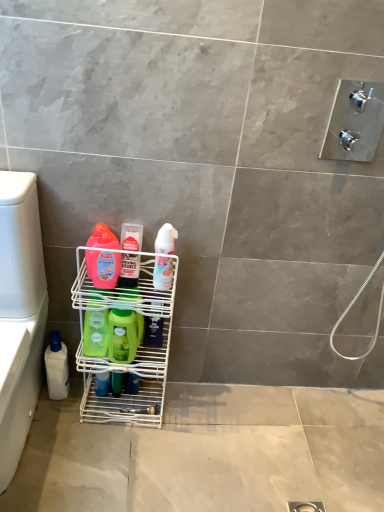
Describe the element at coordinates (122, 336) in the screenshot. I see `green matte bottle at center, the fourth cleaning product from the left` at that location.

In order to face translucent plastic bottle at center, which appears as the 5th cleaning product when viewed from the left, should I rotate leftwards or rightwards?

Turn left by 8.114 degrees to look at translucent plastic bottle at center, which appears as the 5th cleaning product when viewed from the left.

What do you see at coordinates (95, 333) in the screenshot? I see `green matte bottle at center, which ranks as the 2th cleaning product in left-to-right order` at bounding box center [95, 333].

What is the approximate height of green matte bottle at center, which is counted as the 6th cleaning product, starting from the left?

The height of green matte bottle at center, which is counted as the 6th cleaning product, starting from the left, is 6.02 inches.

Find the location of `green matte bottle at center, positioned as the 2th cleaning product in right-to-left order`. green matte bottle at center, positioned as the 2th cleaning product in right-to-left order is located at coordinates (153, 331).

Image resolution: width=384 pixels, height=512 pixels. In order to click on green matte bottle at center, the fourth cleaning product from the left in this screenshot , I will do `click(122, 336)`.

Which of these two, green matte bottle at center, arranged as the sixth cleaning product when viewed from the right, or white plastic bottle at lower left, is bigger?

With larger size is white plastic bottle at lower left.

Between green matte bottle at center, arranged as the sixth cleaning product when viewed from the right, and white plastic bottle at lower left, which one is positioned behind?

green matte bottle at center, arranged as the sixth cleaning product when viewed from the right, is further from the camera.

From a real-world perspective, count 2nd cleaning products downward from the white plastic bottle at lower left and point to it. Please provide its 2D coordinates.

[(95, 333)]

From their relative heights in the image, would you say green matte bottle at center, arranged as the sixth cleaning product when viewed from the right, is taller or shorter than white plastic bottle at lower left?

In the image, green matte bottle at center, arranged as the sixth cleaning product when viewed from the right, appears to be shorter than white plastic bottle at lower left.

Can you tell me how much matte pink bottle at center left, acting as the fifth cleaning product starting from the right, and green matte bottle at center, arranged as the sixth cleaning product when viewed from the right, differ in facing direction?

There is a 3.24-degree angle between the facing directions of matte pink bottle at center left, acting as the fifth cleaning product starting from the right, and green matte bottle at center, arranged as the sixth cleaning product when viewed from the right.

Considering the relative positions of matte pink bottle at center left, acting as the fifth cleaning product starting from the right, and green matte bottle at center, which ranks as the 2th cleaning product in left-to-right order, in the image provided, is matte pink bottle at center left, acting as the fifth cleaning product starting from the right, to the left or to the right of green matte bottle at center, which ranks as the 2th cleaning product in left-to-right order,?

From the image, it's evident that matte pink bottle at center left, acting as the fifth cleaning product starting from the right, is to the right of green matte bottle at center, which ranks as the 2th cleaning product in left-to-right order.

Which object is wider, matte pink bottle at center left, acting as the fifth cleaning product starting from the right, or green matte bottle at center, arranged as the sixth cleaning product when viewed from the right?

Wider between the two is green matte bottle at center, arranged as the sixth cleaning product when viewed from the right.

In the scene shown: Is green matte bottle at center, which ranks as the 2th cleaning product in left-to-right order, at the back of matte pink bottle at center left, which is the third cleaning product from left to right?

matte pink bottle at center left, which is the third cleaning product from left to right, is not turned away from green matte bottle at center, which ranks as the 2th cleaning product in left-to-right order.

Does white plastic bottle at lower left touch white glossy lotion at center, the first cleaning product positioned from the right?

white plastic bottle at lower left and white glossy lotion at center, the first cleaning product positioned from the right, are not in contact.

From the image's perspective, count 5th cleaning products upward from the white plastic bottle at lower left and point to it. Please provide its 2D coordinates.

[(163, 273)]

Based on the photo, is white glossy lotion at center, the first cleaning product positioned from the right, at the back of white plastic bottle at lower left?

No, white plastic bottle at lower left is not facing the opposite direction of white glossy lotion at center, the first cleaning product positioned from the right.

From the image's perspective, is white plastic bottle at lower left positioned above or below white glossy lotion at center, the first cleaning product positioned from the right?

Clearly, from the image's perspective, white plastic bottle at lower left is below white glossy lotion at center, the first cleaning product positioned from the right.

Could you tell me if green matte bottle at center, which ranks as the 2th cleaning product in left-to-right order, is facing translucent plastic bottle at center, which appears as the 5th cleaning product when viewed from the left?

No.

Can you confirm if green matte bottle at center, which ranks as the 2th cleaning product in left-to-right order, is thinner than translucent plastic bottle at center, arranged as the third cleaning product when viewed from the right?

No, green matte bottle at center, which ranks as the 2th cleaning product in left-to-right order, is not thinner than translucent plastic bottle at center, arranged as the third cleaning product when viewed from the right.

Would you say green matte bottle at center, which ranks as the 2th cleaning product in left-to-right order, is inside or outside translucent plastic bottle at center, which appears as the 5th cleaning product when viewed from the left?

green matte bottle at center, which ranks as the 2th cleaning product in left-to-right order, lies outside translucent plastic bottle at center, which appears as the 5th cleaning product when viewed from the left.

From the image's perspective, is green matte bottle at center, arranged as the sixth cleaning product when viewed from the right, located above or below translucent plastic bottle at center, arranged as the third cleaning product when viewed from the right?

Clearly, from the image's perspective, green matte bottle at center, arranged as the sixth cleaning product when viewed from the right, is below translucent plastic bottle at center, arranged as the third cleaning product when viewed from the right.

Does green matte bottle at center, which is counted as the 6th cleaning product, starting from the left, lie in front of white glossy lotion at center, the first cleaning product positioned from the right?

No, green matte bottle at center, which is counted as the 6th cleaning product, starting from the left, is behind white glossy lotion at center, the first cleaning product positioned from the right.

Between green matte bottle at center, which is counted as the 6th cleaning product, starting from the left, and white glossy lotion at center, the first cleaning product positioned from the right, which one has smaller width?

white glossy lotion at center, the first cleaning product positioned from the right.

Does green matte bottle at center, which is counted as the 6th cleaning product, starting from the left, have a smaller size compared to white glossy lotion at center, the first cleaning product positioned from the right?

Correct, green matte bottle at center, which is counted as the 6th cleaning product, starting from the left, occupies less space than white glossy lotion at center, the first cleaning product positioned from the right.

From a real-world perspective, which is physically below, green matte bottle at center, which is counted as the 6th cleaning product, starting from the left, or white glossy lotion at center, the 7th cleaning product positioned from the left?

green matte bottle at center, which is counted as the 6th cleaning product, starting from the left, is physically lower.

Considering the positions of objects green matte bottle at center, which is counted as the 6th cleaning product, starting from the left, and white plastic bottle at lower left in the image provided, who is behind, green matte bottle at center, which is counted as the 6th cleaning product, starting from the left, or white plastic bottle at lower left?

green matte bottle at center, which is counted as the 6th cleaning product, starting from the left, is further from the camera.

Could you measure the distance between green matte bottle at center, which is counted as the 6th cleaning product, starting from the left, and white plastic bottle at lower left?

green matte bottle at center, which is counted as the 6th cleaning product, starting from the left, is 15.74 inches away from white plastic bottle at lower left.

Which is farther from the camera, (159, 331) or (13, 357)?

The point (159, 331) is behind.

Is green matte bottle at center, positioned as the 2th cleaning product in right-to-left order, to the right of white plastic bottle at lower left from the viewer's perspective?

Correct, you'll find green matte bottle at center, positioned as the 2th cleaning product in right-to-left order, to the right of white plastic bottle at lower left.

Is matte pink bottle at center left, which is the third cleaning product from left to right, in contact with white plastic bottle at lower left?

No, matte pink bottle at center left, which is the third cleaning product from left to right, is not beside white plastic bottle at lower left.

Does matte pink bottle at center left, which is the third cleaning product from left to right, appear on the right side of white plastic bottle at lower left?

Yes, matte pink bottle at center left, which is the third cleaning product from left to right, is to the right of white plastic bottle at lower left.

Measure the distance from matte pink bottle at center left, acting as the fifth cleaning product starting from the right, to white plastic bottle at lower left.

The distance of matte pink bottle at center left, acting as the fifth cleaning product starting from the right, from white plastic bottle at lower left is 10.18 inches.

Considering the points (97, 254) and (22, 298), which point is behind, point (97, 254) or point (22, 298)?

The point (97, 254) is farther.

Locate an element on the screen. This screenshot has width=384, height=512. the 2nd cleaning product located beneath the white plastic bottle at lower left (from a real-world perspective) is located at coordinates click(95, 333).

Starting from the matte pink bottle at center left, which is the third cleaning product from left to right, which cleaning product is the 1st one to the left? Please provide its 2D coordinates.

[(95, 333)]

Which object lies nearer to the anchor point white glossy lotion at center, the first cleaning product positioned from the right, translucent plastic bottle at center, arranged as the third cleaning product when viewed from the right, or white plastic bottle at lower left, the seventh cleaning product positioned from the right?

Based on the image, translucent plastic bottle at center, arranged as the third cleaning product when viewed from the right, appears to be nearer to white glossy lotion at center, the first cleaning product positioned from the right.

Looking at the image, which one is located closer to green matte bottle at center, arranged as the sixth cleaning product when viewed from the right, green matte bottle at center, the fourth cleaning product in the right-to-left sequence, or green matte bottle at center, positioned as the 2th cleaning product in right-to-left order?

Among the two, green matte bottle at center, the fourth cleaning product in the right-to-left sequence, is located nearer to green matte bottle at center, arranged as the sixth cleaning product when viewed from the right.

From the image, which object appears to be farther from white plastic bottle at lower left, white plastic bottle at lower left, the seventh cleaning product positioned from the right, or white glossy lotion at center, the 7th cleaning product positioned from the left?

white glossy lotion at center, the 7th cleaning product positioned from the left, is further to white plastic bottle at lower left.

Which object lies further to the anchor point translucent plastic bottle at center, which appears as the 5th cleaning product when viewed from the left, matte pink bottle at center left, which is the third cleaning product from left to right, or white glossy lotion at center, the 7th cleaning product positioned from the left?

white glossy lotion at center, the 7th cleaning product positioned from the left, is further to translucent plastic bottle at center, which appears as the 5th cleaning product when viewed from the left.

Estimate the real-world distances between objects in this image. Which object is closer to white wire rack at lower left, green matte bottle at center, the fourth cleaning product from the left, or green matte bottle at center, which ranks as the 2th cleaning product in left-to-right order?

green matte bottle at center, the fourth cleaning product from the left, is closer to white wire rack at lower left.

Looking at the image, which one is located closer to white plastic bottle at lower left, positioned as the first cleaning product in left-to-right order, white glossy lotion at center, the 7th cleaning product positioned from the left, or green matte bottle at center, positioned as the 2th cleaning product in right-to-left order?

green matte bottle at center, positioned as the 2th cleaning product in right-to-left order, is closer to white plastic bottle at lower left, positioned as the first cleaning product in left-to-right order.

Estimate the real-world distances between objects in this image. Which object is further from white plastic bottle at lower left, translucent plastic bottle at center, which appears as the 5th cleaning product when viewed from the left, or white plastic bottle at lower left, the seventh cleaning product positioned from the right?

translucent plastic bottle at center, which appears as the 5th cleaning product when viewed from the left, lies further to white plastic bottle at lower left than the other object.

Looking at the image, which one is located closer to translucent plastic bottle at center, which appears as the 5th cleaning product when viewed from the left, green matte bottle at center, which is counted as the 6th cleaning product, starting from the left, or white glossy lotion at center, the first cleaning product positioned from the right?

white glossy lotion at center, the first cleaning product positioned from the right.

What are the coordinates of `cleaning product between white glossy lotion at center, the 7th cleaning product positioned from the left, and green matte bottle at center, positioned as the 2th cleaning product in right-to-left order, vertically` in the screenshot? It's located at (103, 268).

At what (x,y) coordinates should I click in order to perform the action: click on shelf between translucent plastic bottle at center, arranged as the third cleaning product when viewed from the right, and white plastic bottle at lower left, the seventh cleaning product positioned from the right, in the vertical direction. Please return your answer as a coordinate pair (x, y). The width and height of the screenshot is (384, 512). Looking at the image, I should click on (130, 348).

Locate an element on the screen. The height and width of the screenshot is (512, 384). shelf that lies between white glossy lotion at center, the 7th cleaning product positioned from the left, and white plastic bottle at lower left, the seventh cleaning product positioned from the right, from top to bottom is located at coordinates (130, 348).

Find the location of a particular element. This screenshot has width=384, height=512. shelf between white plastic bottle at lower left, the seventh cleaning product positioned from the right, and green matte bottle at center, which is counted as the 6th cleaning product, starting from the left, in the horizontal direction is located at coordinates point(130,348).